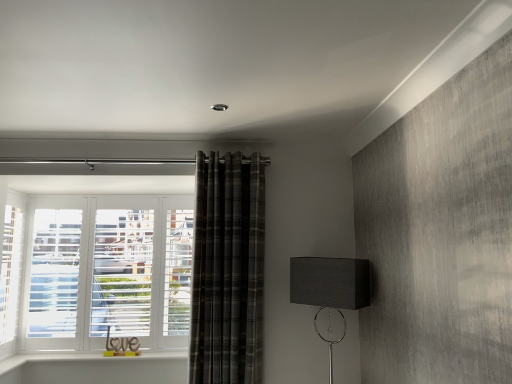
Question: Is plaid fabric curtain at center taller or shorter than matte black rectangular lampshade at lower right?

Choices:
 (A) short
 (B) tall

Answer: (B)

Question: From the image's perspective, is plaid fabric curtain at center positioned above or below matte black rectangular lampshade at lower right?

Choices:
 (A) below
 (B) above

Answer: (B)

Question: Is point (240, 240) positioned closer to the camera than point (290, 296)?

Choices:
 (A) closer
 (B) farther

Answer: (B)

Question: Looking at the image, does matte black rectangular lampshade at lower right seem bigger or smaller compared to plaid fabric curtain at center?

Choices:
 (A) small
 (B) big

Answer: (A)

Question: Is matte black rectangular lampshade at lower right wider or thinner than plaid fabric curtain at center?

Choices:
 (A) thin
 (B) wide

Answer: (B)

Question: Considering the positions of matte black rectangular lampshade at lower right and plaid fabric curtain at center in the image, is matte black rectangular lampshade at lower right taller or shorter than plaid fabric curtain at center?

Choices:
 (A) short
 (B) tall

Answer: (A)

Question: Does point (298, 301) appear closer or farther from the camera than point (241, 193)?

Choices:
 (A) farther
 (B) closer

Answer: (B)